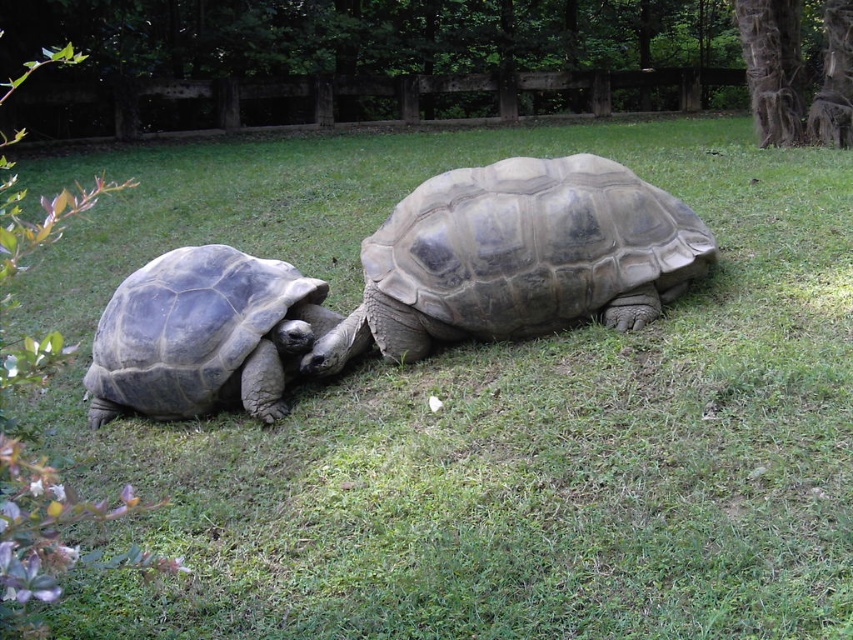
Who is higher up, gray textured tortoise at center or gray matte tortoise at left?

Positioned higher is gray textured tortoise at center.

Image resolution: width=853 pixels, height=640 pixels. Describe the element at coordinates (517, 257) in the screenshot. I see `gray textured tortoise at center` at that location.

The width and height of the screenshot is (853, 640). I want to click on gray textured tortoise at center, so click(517, 257).